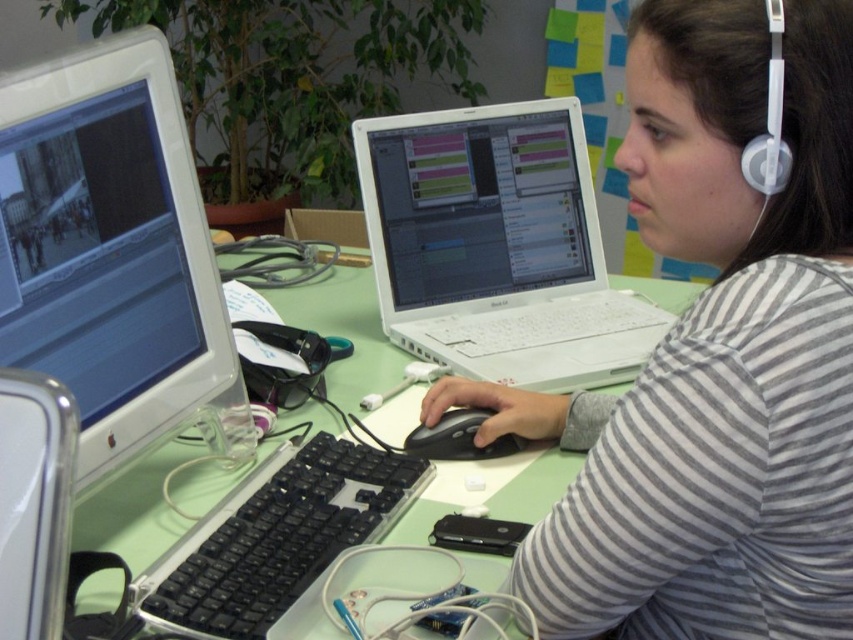
Question: Which of the following is the farthest from the observer?

Choices:
 (A) (448, 426)
 (B) (608, 554)
 (C) (74, 336)

Answer: (A)

Question: Does white glossy monitor at left appear on the right side of green plastic table at center?

Choices:
 (A) no
 (B) yes

Answer: (A)

Question: Which object appears farthest from the camera in this image?

Choices:
 (A) white glossy monitor at left
 (B) black plastic keyboard at center
 (C) black matte mouse at center

Answer: (C)

Question: Which point is farther to the camera?

Choices:
 (A) black plastic keyboard at center
 (B) gray striped shirt at center

Answer: (A)

Question: Is white glossy monitor at left thinner than black matte mouse at center?

Choices:
 (A) no
 (B) yes

Answer: (A)

Question: Is gray striped shirt at center wider than black matte mouse at center?

Choices:
 (A) no
 (B) yes

Answer: (B)